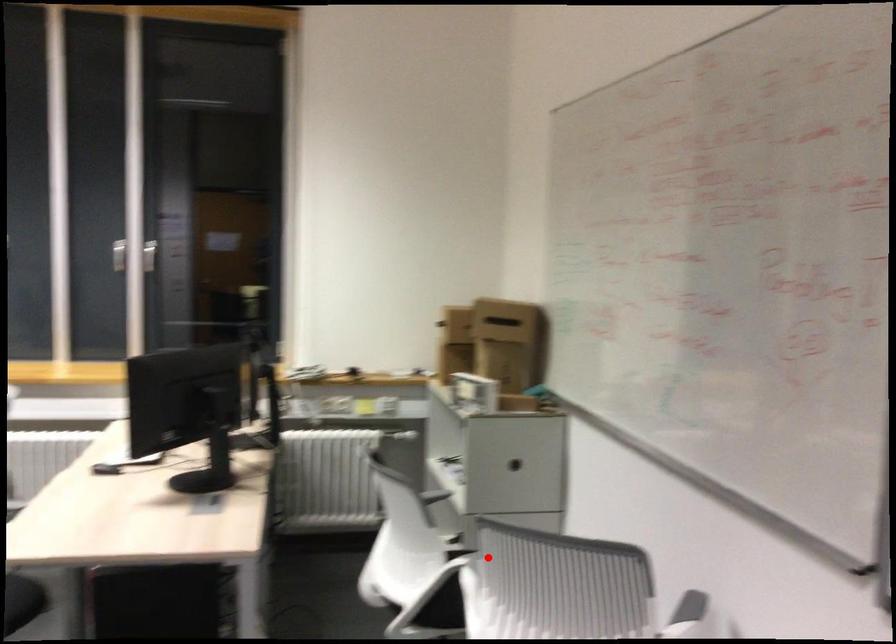
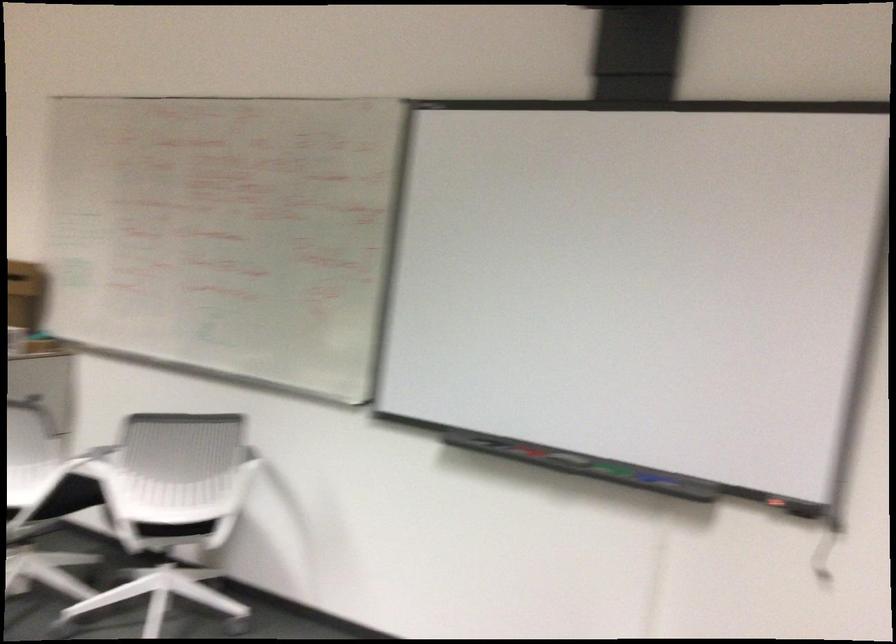
Question: I am providing you with two images of the same scene from different viewpoints. In image1, a red point is highlighted. Considering the same 3D point in image2, which of the following is correct?

Choices:
 (A) It is closer
 (B) It is farther

Answer: (B)